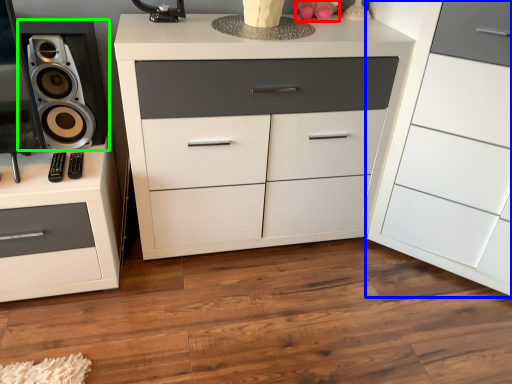
Question: Estimate the real-world distances between objects in this image. Which object is farther from toy (highlighted by a red box), chest of drawers (highlighted by a blue box) or speaker (highlighted by a green box)?

Choices:
 (A) chest of drawers
 (B) speaker

Answer: (B)